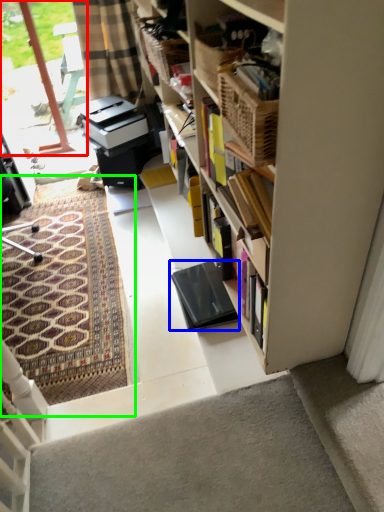
Question: Which object is positioned farthest from glass door (highlighted by a red box)? Select from equipment (highlighted by a blue box) and doormat (highlighted by a green box).

Choices:
 (A) equipment
 (B) doormat

Answer: (A)